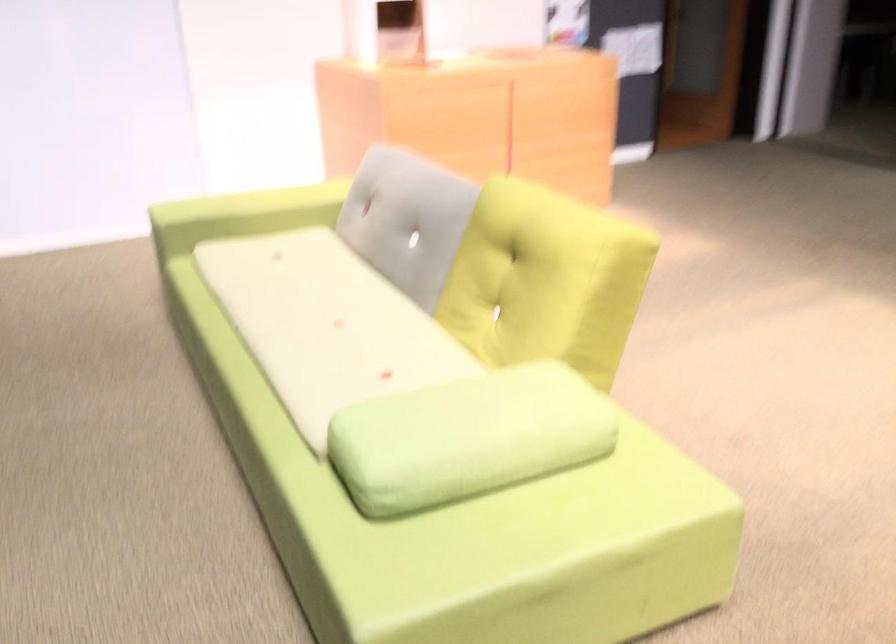
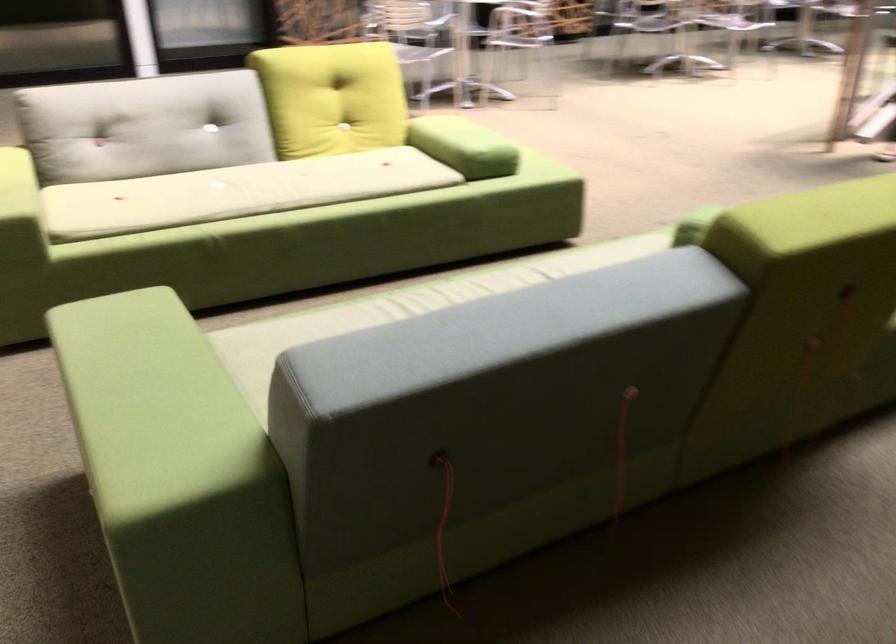
The point at (348, 410) is marked in the first image. Where is the corresponding point in the second image?

(464, 146)